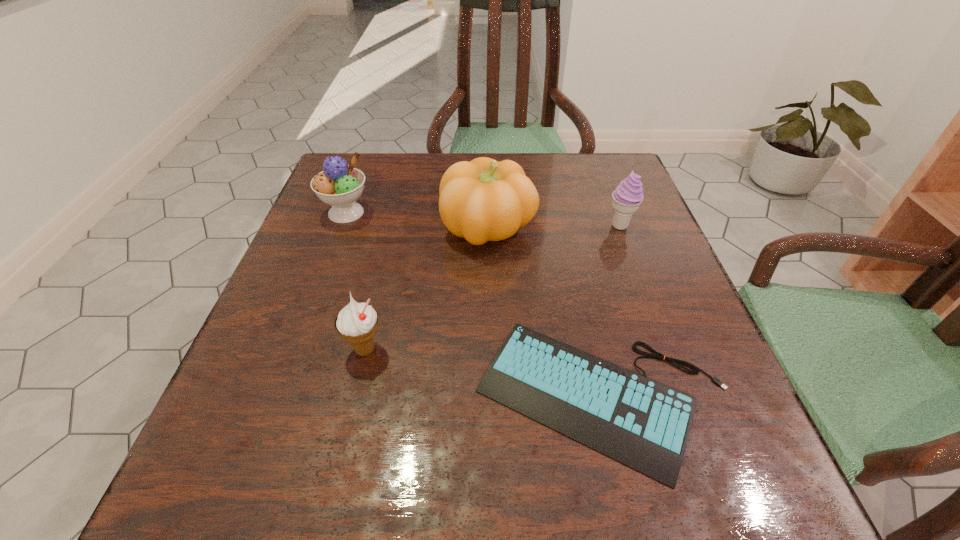
In the image, there is a desktop. Find the location of `free space at the left edge`. free space at the left edge is located at coordinates (339, 237).

In the image, there is a desktop. Where is `blank space at the right edge`? blank space at the right edge is located at coordinates (641, 207).

The height and width of the screenshot is (540, 960). In the image, there is a desktop. Find the location of `vacant area at the far right corner`. vacant area at the far right corner is located at coordinates (579, 159).

You are a GUI agent. You are given a task and a screenshot of the screen. Output one action in this format:
    pyautogui.click(x=<x>, y=<y>)
    Task: Click on the empty location between the leftmost icecream and the second icecream from left to right
    
    Given the screenshot: What is the action you would take?
    pyautogui.click(x=355, y=281)

Where is `free area in between the leftmost icecream and the pumpkin`? The image size is (960, 540). free area in between the leftmost icecream and the pumpkin is located at coordinates (418, 220).

Locate an element on the screen. The width and height of the screenshot is (960, 540). free space between the computer keyboard and the nearest icecream is located at coordinates (485, 374).

Identify the location of free space that is in between the nearest icecream and the pumpkin. (426, 288).

Identify the location of vacant space that's between the shortest object and the nearest icecream. (485, 374).

Locate an element on the screen. The height and width of the screenshot is (540, 960). vacant area between the leftmost icecream and the computer keyboard is located at coordinates (475, 306).

Image resolution: width=960 pixels, height=540 pixels. In order to click on vacant area that lies between the rightmost icecream and the nearest icecream in this screenshot , I will do `click(492, 288)`.